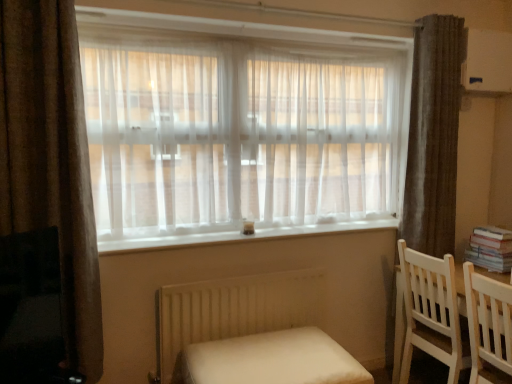
This screenshot has height=384, width=512. I want to click on free spot above translucent fabric window at center (from a real-world perspective), so 256,33.